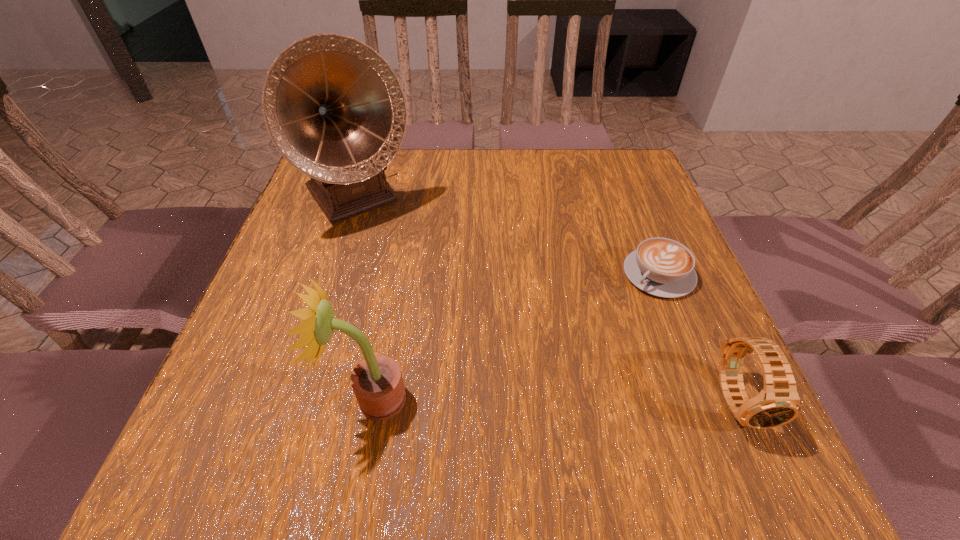
Image resolution: width=960 pixels, height=540 pixels. What are the coordinates of `free space on the desktop that is between the third shortest object and the second shortest object and is positioned on the side of the cappuccino with the handle` in the screenshot? It's located at (521, 399).

The image size is (960, 540). I want to click on vacant space on the desktop that is between the sunflower and the watch and is positioned on the horn of the tallest object, so click(516, 399).